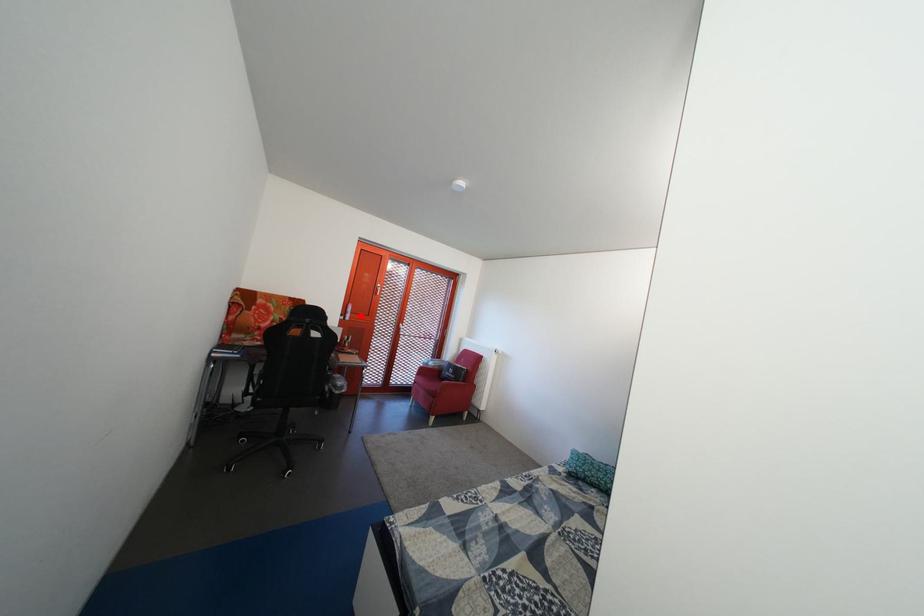
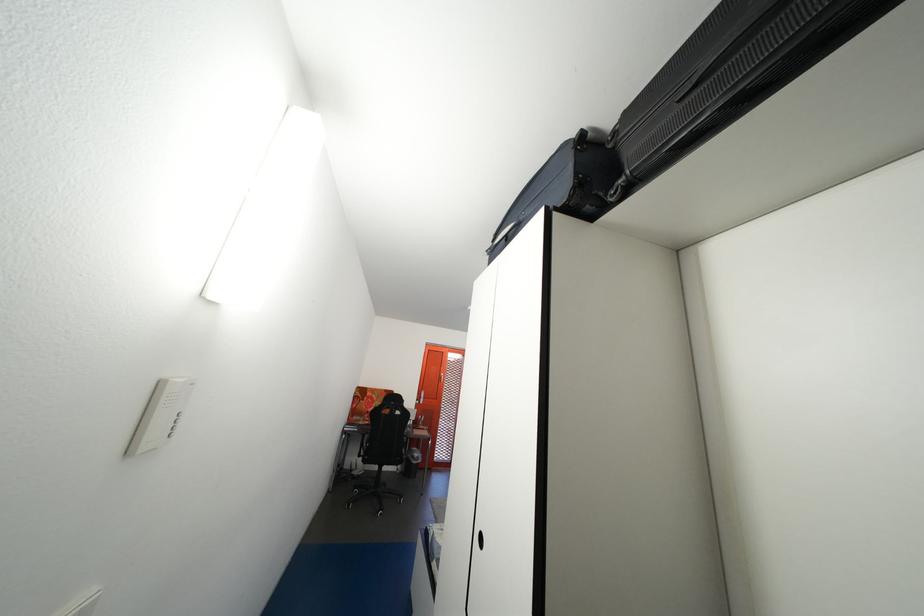
Locate, in the second image, the point that corresponds to the highlighted location in the first image.

(433, 402)